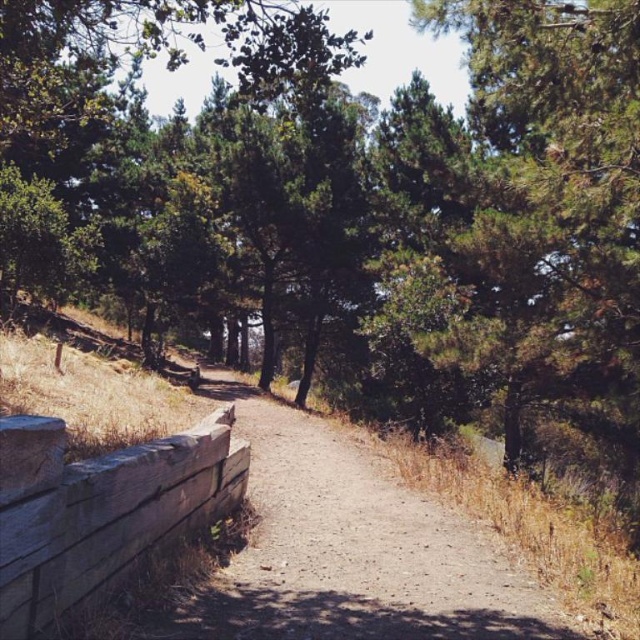
Question: Which object is closer to the camera taking this photo?

Choices:
 (A) dirt path at center
 (B) weathered wood at lower left

Answer: (B)

Question: Considering the relative positions of dirt path at center and weathered wood at lower left in the image provided, where is dirt path at center located with respect to weathered wood at lower left?

Choices:
 (A) below
 (B) above

Answer: (A)

Question: Is dirt path at center to the left of weathered wood at lower left from the viewer's perspective?

Choices:
 (A) yes
 (B) no

Answer: (B)

Question: Which point appears closest to the camera in this image?

Choices:
 (A) (68, 598)
 (B) (412, 506)

Answer: (A)

Question: Among these objects, which one is nearest to the camera?

Choices:
 (A) dirt path at center
 (B) weathered wood at lower left

Answer: (B)

Question: Can you confirm if dirt path at center is positioned above weathered wood at lower left?

Choices:
 (A) no
 (B) yes

Answer: (A)